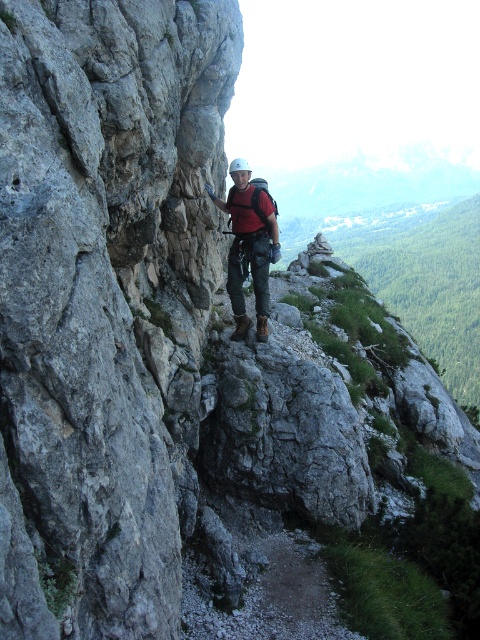
Does gray rough rock face at center have a larger size compared to matte red shirt at center?

Yes, gray rough rock face at center is bigger than matte red shirt at center.

Is gray rough rock face at center wider than matte red shirt at center?

Correct, the width of gray rough rock face at center exceeds that of matte red shirt at center.

Is point (9, 419) closer to camera compared to point (273, 237)?

Yes, it is in front of point (273, 237).

Locate an element on the screen. gray rough rock face at center is located at coordinates (105, 301).